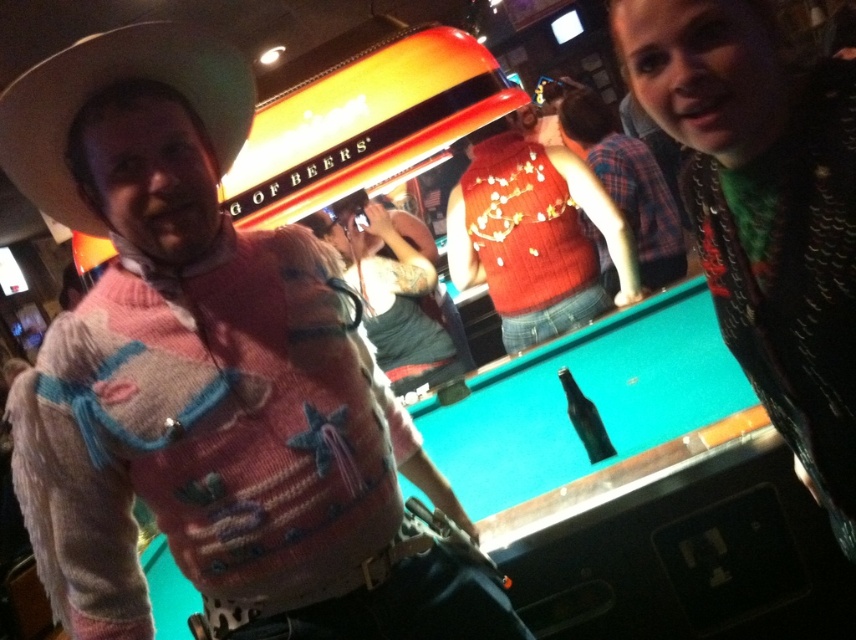
You are standing in the bar scene described. There is a point at coordinates (x=535, y=236). What object is located at that point?

The point at coordinates (x=535, y=236) corresponds to the knitted red sweater at center.

What are the coordinates of the knitted red sweater at center?

The knitted red sweater at center is located at point (535, 236).